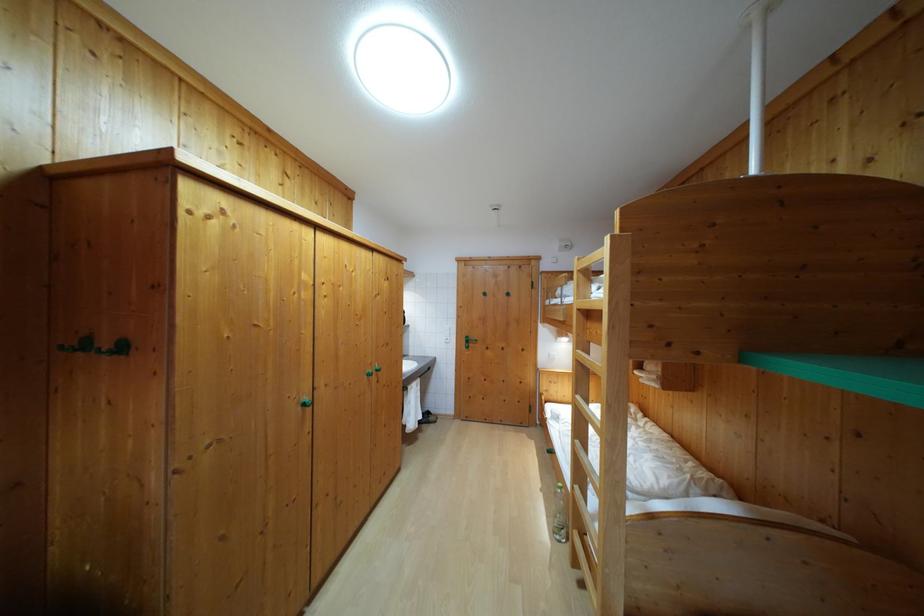
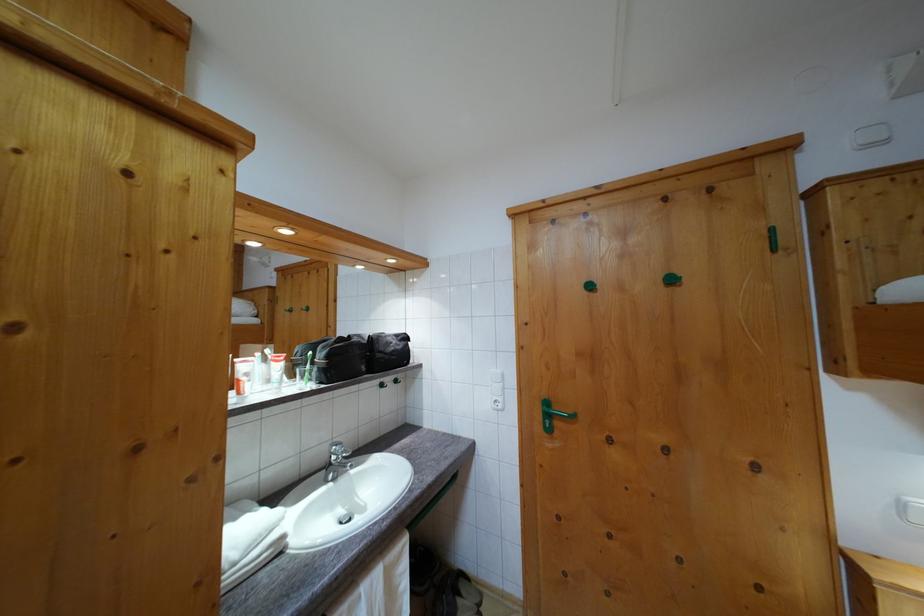
Locate, in the second image, the point that corresponds to (x=489, y=302) in the first image.

(593, 294)